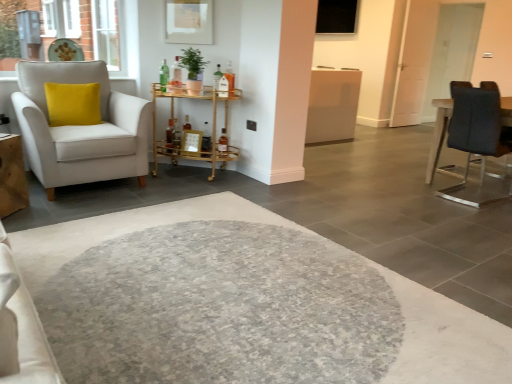
Question: Can you confirm if brick wall at upper left is positioned to the right of matte glass bottle at center?

Choices:
 (A) no
 (B) yes

Answer: (A)

Question: Is brick wall at upper left facing away from matte glass bottle at center?

Choices:
 (A) yes
 (B) no

Answer: (B)

Question: From a real-world perspective, is brick wall at upper left under matte glass bottle at center?

Choices:
 (A) yes
 (B) no

Answer: (B)

Question: Could you tell me if brick wall at upper left is facing matte glass bottle at center?

Choices:
 (A) no
 (B) yes

Answer: (A)

Question: Is brick wall at upper left closer to the viewer compared to matte glass bottle at center?

Choices:
 (A) yes
 (B) no

Answer: (B)

Question: In terms of width, does white glossy door at upper right look wider or thinner when compared to brick wall at upper left?

Choices:
 (A) wide
 (B) thin

Answer: (B)

Question: From the image's perspective, is white glossy door at upper right located above or below brick wall at upper left?

Choices:
 (A) below
 (B) above

Answer: (B)

Question: Is white glossy door at upper right inside or outside of brick wall at upper left?

Choices:
 (A) inside
 (B) outside

Answer: (B)

Question: Visually, is white glossy door at upper right positioned to the left or to the right of brick wall at upper left?

Choices:
 (A) left
 (B) right

Answer: (B)

Question: From a real-world perspective, is black glass window screen at upper center positioned above or below matte glass bottle at center?

Choices:
 (A) below
 (B) above

Answer: (B)

Question: Relative to matte glass bottle at center, is black glass window screen at upper center in front or behind?

Choices:
 (A) front
 (B) behind

Answer: (B)

Question: From the image's perspective, is black glass window screen at upper center located above or below matte glass bottle at center?

Choices:
 (A) above
 (B) below

Answer: (A)

Question: Based on their sizes in the image, would you say black glass window screen at upper center is bigger or smaller than matte glass bottle at center?

Choices:
 (A) small
 (B) big

Answer: (B)

Question: Considering the positions of point (x=55, y=84) and point (x=162, y=66), is point (x=55, y=84) closer or farther from the camera than point (x=162, y=66)?

Choices:
 (A) closer
 (B) farther

Answer: (A)

Question: From the image's perspective, is yellow velvet pillow at left positioned above or below matte glass bottle at center?

Choices:
 (A) below
 (B) above

Answer: (A)